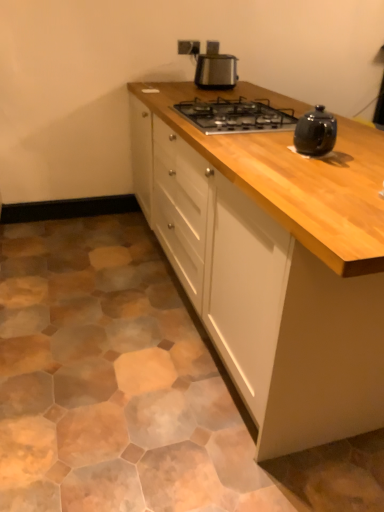
Question: In the image, is black metal gas stove at center positioned in front of or behind satin metallic toaster at upper center?

Choices:
 (A) front
 (B) behind

Answer: (A)

Question: Is point (258, 100) positioned closer to the camera than point (196, 82)?

Choices:
 (A) farther
 (B) closer

Answer: (B)

Question: Based on their relative distances, which object is nearer to the black metal gas stove at center?

Choices:
 (A) white wood cabinet at center
 (B) satin metallic toaster at upper center

Answer: (A)

Question: Which object is positioned farthest from the black metal gas stove at center?

Choices:
 (A) satin metallic toaster at upper center
 (B) white wood cabinet at center

Answer: (A)